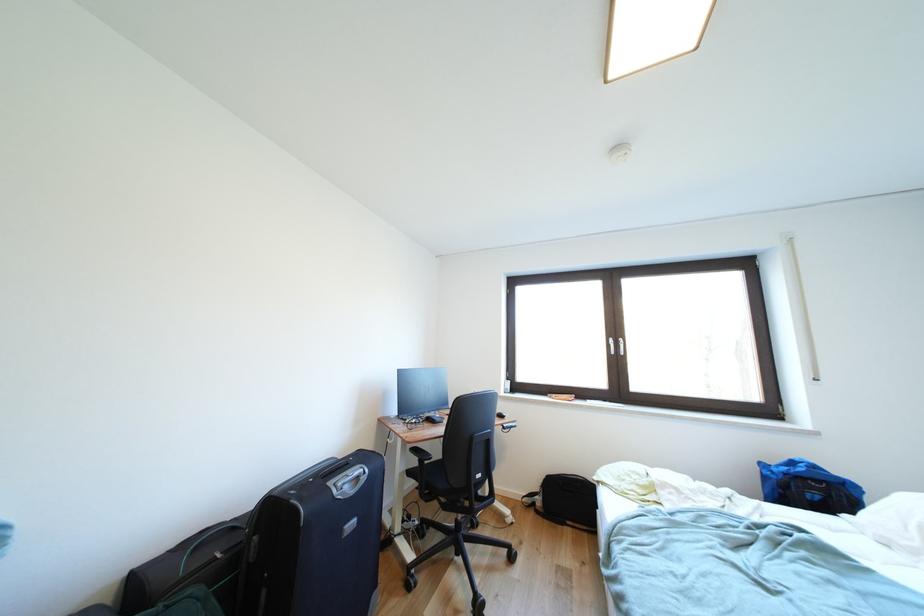
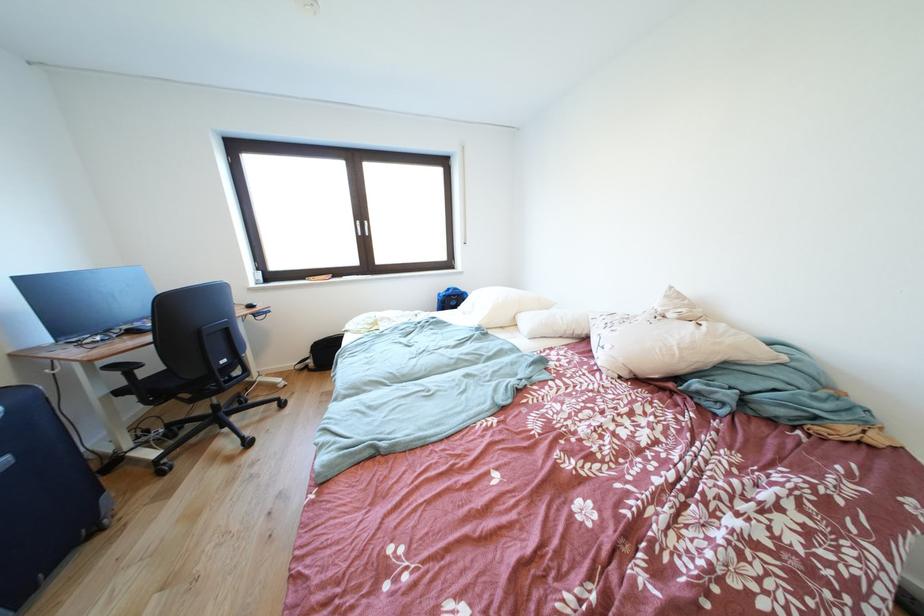
In the second image, find the point that corresponds to (769,468) in the first image.

(447, 299)